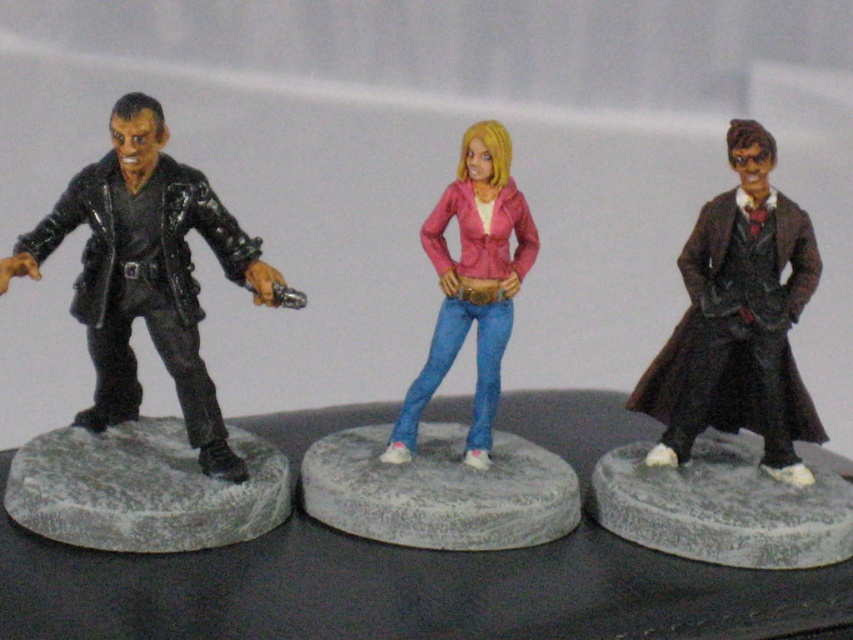
You are a photographer setting up a camera to capture the two points marked in the image. The first point is at coordinates point (367, 435) and the second point is at point (622, 481). Which of these two points is closer to the camera?

Point (367, 435) is closer to the camera because it is further to the viewer than point (622, 481).

You are a collector who wants to display the shiny brown coat at right and the gray stone at center on a shelf. If you want to arrange them so that the taller object is on the left side of the shelf, which object should you place on the left?

The shiny brown coat at right is much taller than the gray stone at center, so you should place the shiny brown coat at right on the left side of the shelf.

What is located at the coordinates point [738,321]?

The shiny brown coat at right is located at point [738,321].